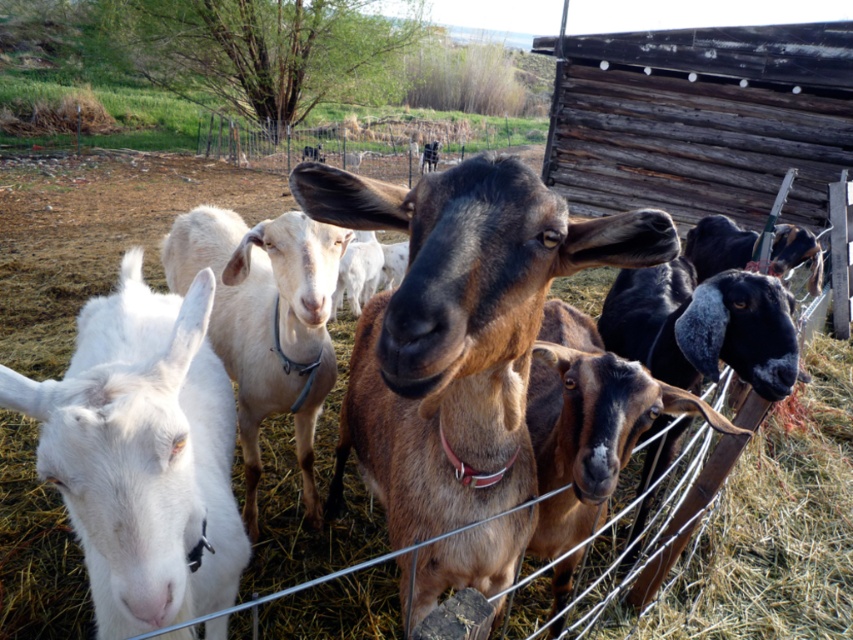
Does white woolen goat at center have a lesser height compared to white smooth goat at center?

Indeed, white woolen goat at center has a lesser height compared to white smooth goat at center.

Does white woolen goat at center have a greater height compared to white smooth goat at center?

Incorrect, white woolen goat at center's height is not larger of white smooth goat at center's.

Does point (165, 444) come behind point (312, 467)?

No.

In order to click on white woolen goat at center in this screenshot , I will do `click(142, 452)`.

Is brown furry goat at center wider than white smooth goat at center?

No.

Which is in front, point (426, 177) or point (256, 307)?

Positioned in front is point (426, 177).

Is point (672, 234) farther from camera compared to point (247, 388)?

No, it is in front of (247, 388).

Where is `brown furry goat at center`? The image size is (853, 640). brown furry goat at center is located at coordinates (457, 330).

Does point (434, 257) come farther from viewer compared to point (195, 420)?

No, it is in front of (195, 420).

Does brown furry goat at center have a lesser width compared to white woolen goat at center?

Yes.

Identify the location of brown furry goat at center. This screenshot has height=640, width=853. (457, 330).